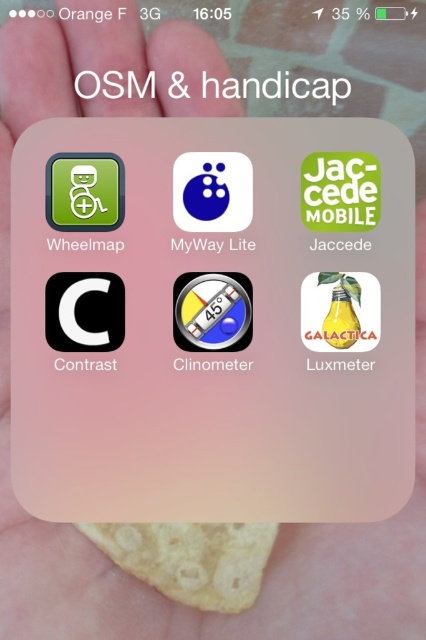
You are a scientist conducting an experiment on surface tension. You have a yellow crispy chip at center and a translucent glass clinometer at center. Which object is resting on top of the other?

The yellow crispy chip at center is positioned under the translucent glass clinometer at center, so the clinometer is resting on top of the chip.

You are trying to determine which object is taller between the yellow crispy chip at center and the translucent glass clinometer at center. Based on the scene provided, which one is taller?

The yellow crispy chip at center is taller than the translucent glass clinometer at center according to the description.